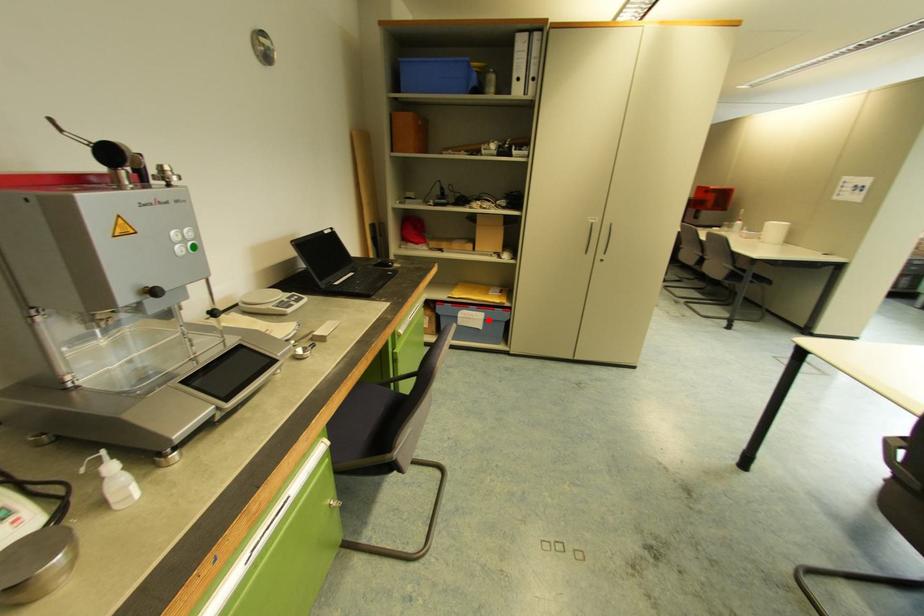
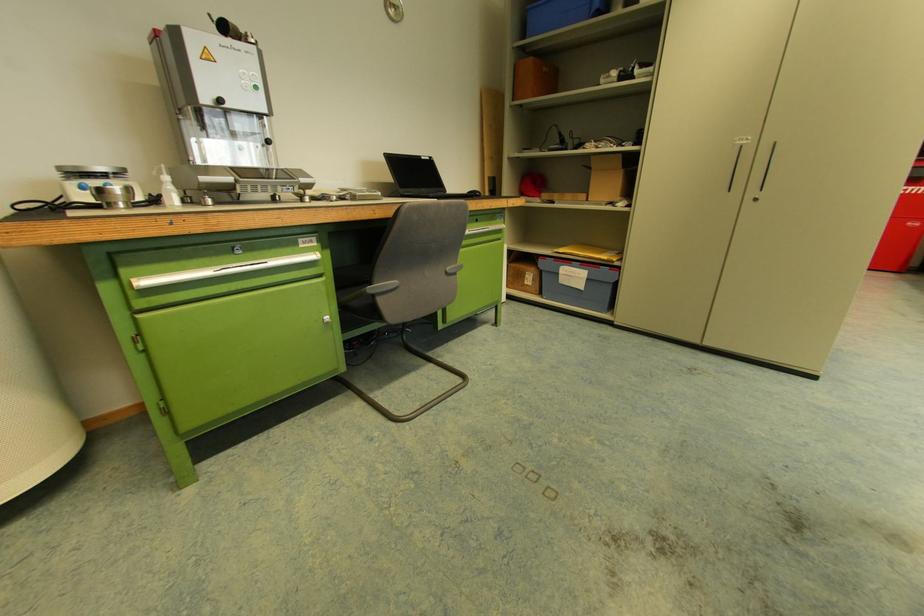
Question: A red point is marked in image1. In image2, is the corresponding 3D point closer to the camera or farther? Reply with the corresponding letter.

Choices:
 (A) The corresponding 3D point is closer.
 (B) The corresponding 3D point is farther.

Answer: (A)